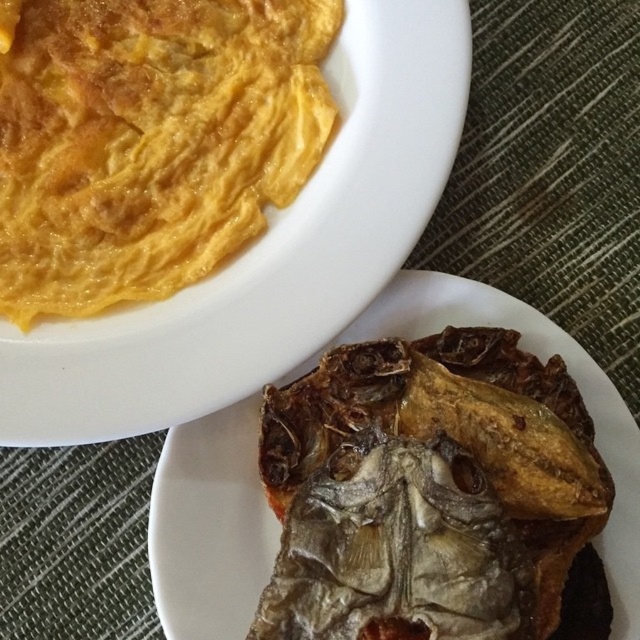
Question: Is brown crispy fish at lower right above yellow soft omelette at upper left?

Choices:
 (A) no
 (B) yes

Answer: (A)

Question: Does brown crispy fish at lower right have a greater width compared to yellow soft omelette at upper left?

Choices:
 (A) yes
 (B) no

Answer: (B)

Question: From the image, what is the correct spatial relationship of brown crispy fish at lower right in relation to yellow soft omelette at upper left?

Choices:
 (A) right
 (B) left

Answer: (A)